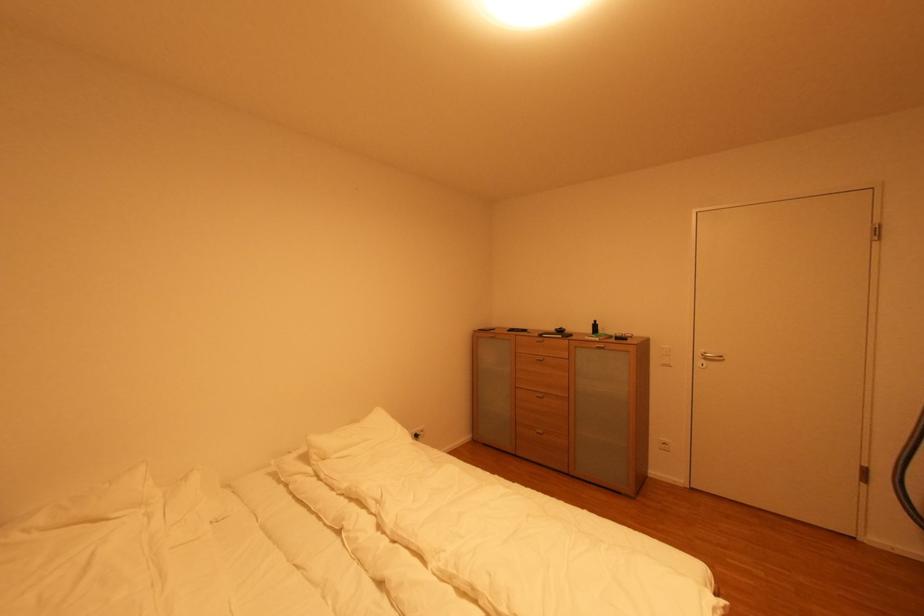
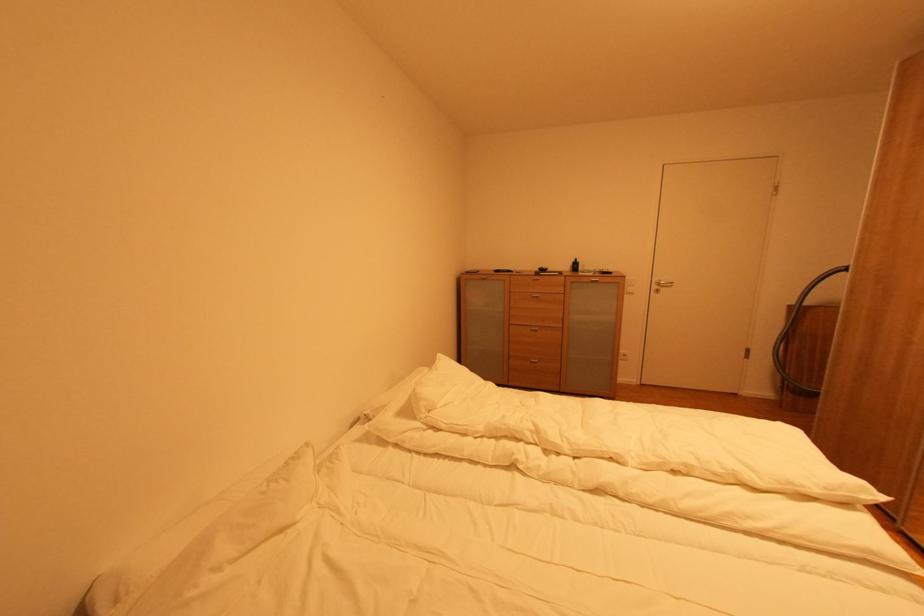
Question: Which direction would the cameraman need to move to produce the second image? Reply with the corresponding letter.

Choices:
 (A) Left
 (B) Right
 (C) Forward
 (D) Backward

Answer: (A)